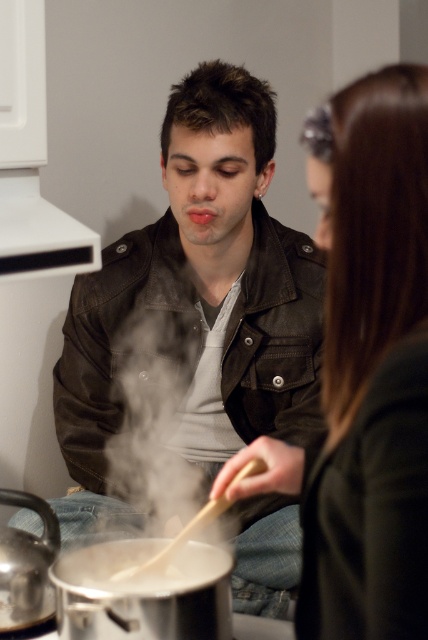
You are a delivery person standing at the entrance of the kitchen. You need to hand a package to the person with the smooth brown hair at upper right. Can you directly hand it to them without moving past the matte black jacket at center?

The matte black jacket at center is further to the viewer than smooth brown hair at upper right, so you cannot directly hand the package to the person with the smooth brown hair at upper right without moving past the matte black jacket at center.

You are a chef in a busy kitchen and need to quickly grab the white matte pot at lower center to adjust the heat. However, there is a matte black jacket at center in your way. Based on their positions, can you reach the pot without moving the jacket?

The matte black jacket at center is to the right of the white matte pot at lower center, so the jacket is blocking the path to the pot. You would need to move the jacket to the side to access the pot.